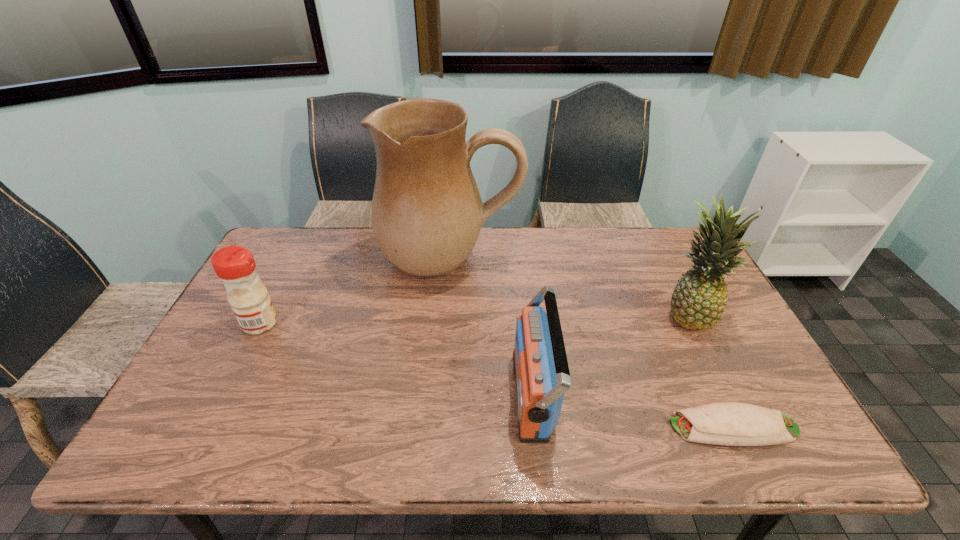
Where is `burrito that is at the right edge`? burrito that is at the right edge is located at coordinates (728, 423).

Locate an element on the screen. This screenshot has width=960, height=540. object located at the near right corner is located at coordinates (728, 423).

This screenshot has width=960, height=540. I want to click on vacant position at the far edge of the desktop, so click(x=592, y=234).

Locate an element on the screen. vacant space at the left edge of the desktop is located at coordinates (216, 348).

This screenshot has width=960, height=540. I want to click on free space at the right edge, so click(x=711, y=390).

This screenshot has height=540, width=960. In order to click on free space at the far left corner in this screenshot , I will do coord(307,247).

Locate an element on the screen. This screenshot has height=540, width=960. vacant space at the near left corner of the desktop is located at coordinates (230, 428).

Image resolution: width=960 pixels, height=540 pixels. I want to click on vacant point located between the pineapple and the radio receiver, so click(x=611, y=354).

Image resolution: width=960 pixels, height=540 pixels. In order to click on vacant point located between the radio receiver and the farthest object in this screenshot , I will do `click(492, 327)`.

Find the location of a particular element. Image resolution: width=960 pixels, height=540 pixels. vacant point located between the radio receiver and the leftmost object is located at coordinates [396, 359].